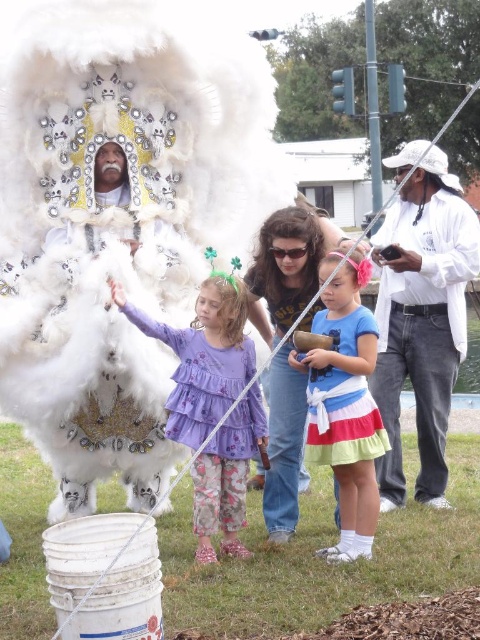
Is white fluffy costume at center taller than matte blue dress at center?

Yes, white fluffy costume at center is taller than matte blue dress at center.

The width and height of the screenshot is (480, 640). Describe the element at coordinates (119, 221) in the screenshot. I see `white fluffy costume at center` at that location.

The width and height of the screenshot is (480, 640). Find the location of `white fluffy costume at center`. white fluffy costume at center is located at coordinates (119, 221).

Is purple cotton dress at center taller than purple chiffon dress at center?

Indeed, purple cotton dress at center has a greater height compared to purple chiffon dress at center.

From the picture: Who is higher up, purple cotton dress at center or purple chiffon dress at center?

Positioned higher is purple chiffon dress at center.

Between point (245, 419) and point (141, 320), which one is positioned behind?

Positioned behind is point (141, 320).

Where is `purple cotton dress at center`? purple cotton dress at center is located at coordinates (202, 356).

Does white fluffy costume at center have a greater height compared to denim jeans at center?

Yes, white fluffy costume at center is taller than denim jeans at center.

Can you confirm if white fluffy costume at center is smaller than denim jeans at center?

No, white fluffy costume at center is not smaller than denim jeans at center.

Between point (51, 355) and point (272, 438), which one is positioned behind?

The point (51, 355) is more distant.

Identify the location of white fluffy costume at center. [119, 221].